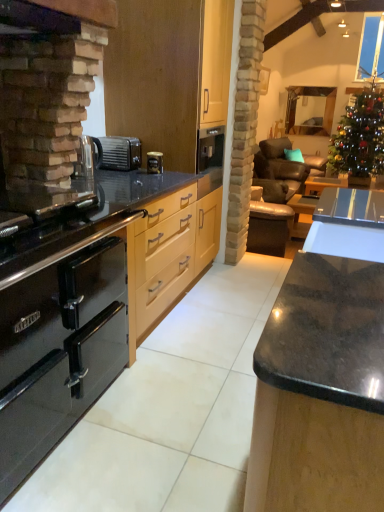
Question: Does black glossy table at center have a lesser height compared to metallic silver coffee machine at center?

Choices:
 (A) yes
 (B) no

Answer: (B)

Question: Is black glossy table at center at the left side of metallic silver coffee machine at center?

Choices:
 (A) no
 (B) yes

Answer: (A)

Question: Is black glossy table at center closer to camera compared to metallic silver coffee machine at center?

Choices:
 (A) no
 (B) yes

Answer: (A)

Question: From the image's perspective, does black glossy table at center appear lower than metallic silver coffee machine at center?

Choices:
 (A) yes
 (B) no

Answer: (A)

Question: Does black glossy table at center have a lesser width compared to metallic silver coffee machine at center?

Choices:
 (A) yes
 (B) no

Answer: (B)

Question: Can you see black glossy table at center touching metallic silver coffee machine at center?

Choices:
 (A) yes
 (B) no

Answer: (B)

Question: Does transparent glass window at upper right have a greater height compared to leather armchair at center?

Choices:
 (A) no
 (B) yes

Answer: (B)

Question: Can you confirm if transparent glass window at upper right is thinner than leather armchair at center?

Choices:
 (A) yes
 (B) no

Answer: (A)

Question: Is transparent glass window at upper right far away from leather armchair at center?

Choices:
 (A) yes
 (B) no

Answer: (A)

Question: Is transparent glass window at upper right placed right next to leather armchair at center?

Choices:
 (A) yes
 (B) no

Answer: (B)

Question: Is transparent glass window at upper right looking in the opposite direction of leather armchair at center?

Choices:
 (A) no
 (B) yes

Answer: (A)

Question: Is transparent glass window at upper right positioned before leather armchair at center?

Choices:
 (A) yes
 (B) no

Answer: (B)

Question: Is green glittering christmas tree at upper right touching transparent glass window at upper right?

Choices:
 (A) yes
 (B) no

Answer: (B)